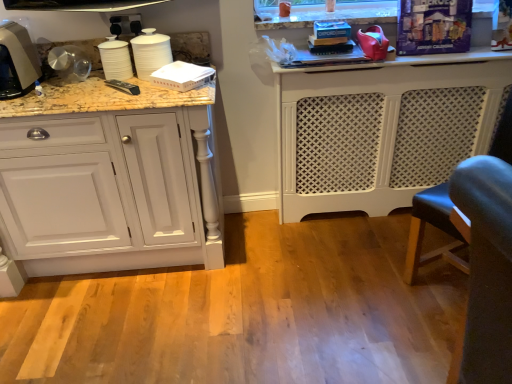
Question: From a real-world perspective, is rubberized red shoe at upper right, which ranks as the 1th appliance in right-to-left order, physically located above or below white matte cups at left, marked as the fourth appliance in a right-to-left arrangement?

Choices:
 (A) below
 (B) above

Answer: (A)

Question: Considering the relative positions of rubberized red shoe at upper right, which ranks as the 1th appliance in right-to-left order, and white matte cups at left, marked as the fourth appliance in a right-to-left arrangement, in the image provided, is rubberized red shoe at upper right, which ranks as the 1th appliance in right-to-left order, to the left or to the right of white matte cups at left, marked as the fourth appliance in a right-to-left arrangement,?

Choices:
 (A) left
 (B) right

Answer: (B)

Question: Which object is the farthest from the metallic silver kettle at left?

Choices:
 (A) rubberized red shoe at upper right, which is the 4th appliance from left to right
 (B) white textured radiator at center, which appears as the first cabinetry when viewed from the right
 (C) white glossy cups at upper left, the 2th appliance positioned from the left
 (D) white paper napkin at upper left, the second appliance in the right-to-left sequence
 (E) matte gray cabinet at left, acting as the first cabinetry starting from the left

Answer: (B)

Question: Based on their relative distances, which object is nearer to the white glossy cups at upper left, marked as the third appliance in a right-to-left arrangement?

Choices:
 (A) rubberized red shoe at upper right, which ranks as the 1th appliance in right-to-left order
 (B) white paper napkin at upper left, the 3th appliance viewed from the left
 (C) matte gray cabinet at left, arranged as the 2th cabinetry when viewed from the right
 (D) white textured radiator at center, which is counted as the second cabinetry, starting from the left
 (E) metallic silver kettle at left

Answer: (B)